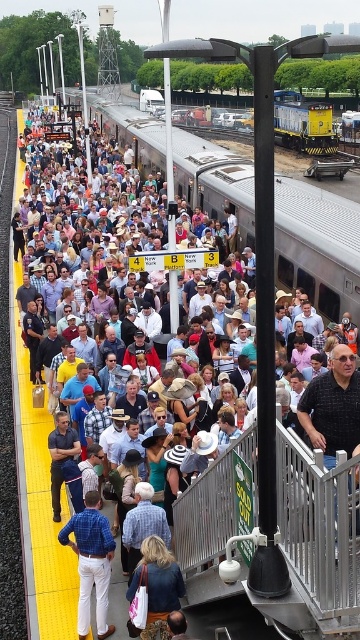
You are a visually impaired person standing on the platform, and you feel the bright yellow tactile paving strip under your feet. You want to move towards the silver metallic train at center without getting too close to the edge. Which direction should you move relative to the metallic silver rail at center?

You should move to the left of the metallic silver rail at center. Since the metallic silver rail at center is to the right of the silver metallic train at center, moving left away from the rail will bring you closer to the train while staying away from the platform edge marked by the tactile paving.

You are standing on the platform and want to find the metallic silver rail at center. According to the coordinates provided, where should you look relative to the platform?

The metallic silver rail at center is located at coordinates 0.831 on the x axis and 0.889 on the y axis relative to the platform.

You are a visually impaired person standing on the platform and want to find the edge of the platform. The tactile paving strip is bright yellow. Which object, the metallic silver rail at center or the silver metallic train at center, is closer to the edge of the platform?

The metallic silver rail at center is closer to the edge of the platform because it is smaller in size compared to the silver metallic train at center, and tactile paving is usually near the edge.